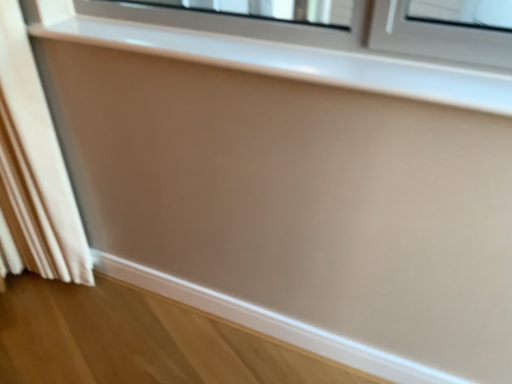
Question: From the image's perspective, is matte white window sill at upper center positioned above or below white fabric curtain at left?

Choices:
 (A) above
 (B) below

Answer: (A)

Question: Is matte white window sill at upper center situated inside white fabric curtain at left or outside?

Choices:
 (A) outside
 (B) inside

Answer: (A)

Question: In terms of size, does matte white window sill at upper center appear bigger or smaller than white fabric curtain at left?

Choices:
 (A) big
 (B) small

Answer: (B)

Question: Is white fabric curtain at left inside or outside of matte white window sill at upper center?

Choices:
 (A) inside
 (B) outside

Answer: (B)

Question: From the image's perspective, is white fabric curtain at left above or below matte white window sill at upper center?

Choices:
 (A) below
 (B) above

Answer: (A)

Question: In the image, is white fabric curtain at left positioned in front of or behind matte white window sill at upper center?

Choices:
 (A) front
 (B) behind

Answer: (B)

Question: Is point (39, 188) positioned closer to the camera than point (395, 79)?

Choices:
 (A) closer
 (B) farther

Answer: (B)